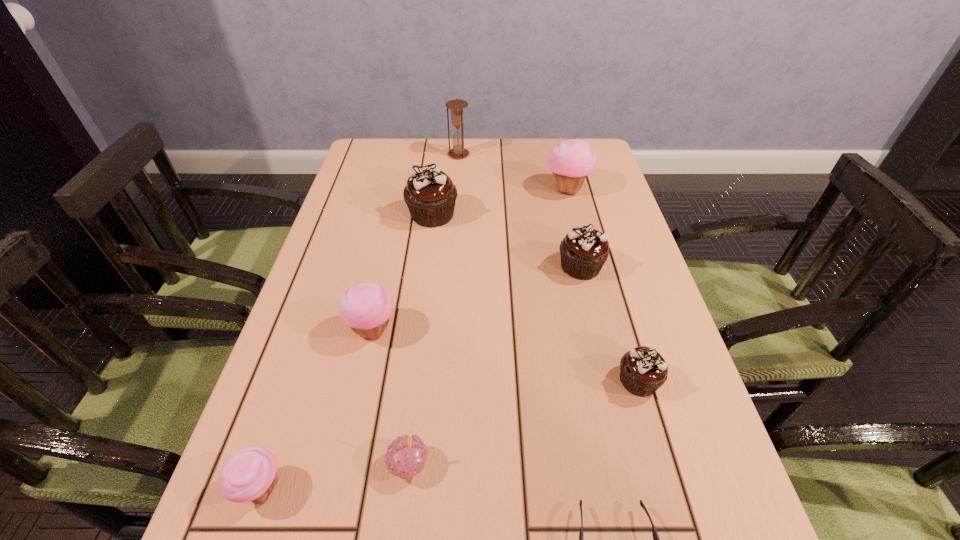
Select which brown cupcake is the second closest to the biggest pink cupcake. Please provide its 2D coordinates. Your answer should be formatted as a tuple, i.e. [(x, y)], where the tuple contains the x and y coordinates of a point satisfying the conditions above.

[(430, 194)]

Find the location of a particular element. This screenshot has height=540, width=960. the fourth closest pink cupcake to the farthest object is located at coordinates (250, 474).

Locate which pink cupcake ranks in proximity to the third farthest cupcake. Please provide its 2D coordinates. Your answer should be formatted as a tuple, i.e. [(x, y)], where the tuple contains the x and y coordinates of a point satisfying the conditions above.

[(570, 161)]

At what (x,y) coordinates should I click in order to perform the action: click on free region that satisfies the following two spatial constraints: 1. on the front side of the rightmost pink cupcake; 2. on the right side of the farthest object. Please return your answer as a coordinate pair (x, y). The height and width of the screenshot is (540, 960). Looking at the image, I should click on [x=456, y=190].

Find the location of a particular element. The width and height of the screenshot is (960, 540). vacant position in the image that satisfies the following two spatial constraints: 1. on the front side of the second pink cupcake from right to left; 2. on the left side of the biggest brown cupcake is located at coordinates (401, 465).

I want to click on free space that satisfies the following two spatial constraints: 1. on the back side of the biggest brown cupcake; 2. on the left side of the rightmost pink cupcake, so click(x=436, y=190).